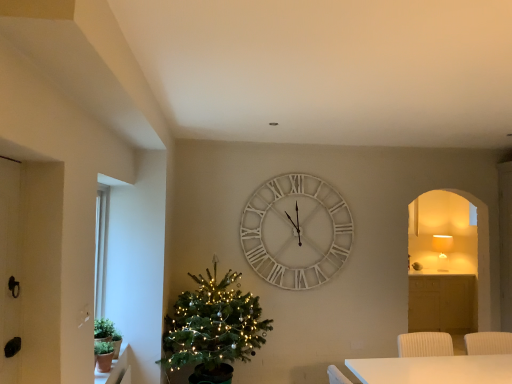
Question: Is point (96, 367) positioned closer to the camera than point (305, 274)?

Choices:
 (A) farther
 (B) closer

Answer: (B)

Question: Is terracotta clay pot at lower left wider or thinner than white wooden clock at center?

Choices:
 (A) wide
 (B) thin

Answer: (A)

Question: Which object is the farthest from the black matte glass door at left?

Choices:
 (A) terracotta clay pot at lower left
 (B) green matte plant at lower left
 (C) white wooden clock at center
 (D) matte white lampshade at right
 (E) green matte christmas tree at left

Answer: (D)

Question: Estimate the real-world distances between objects in this image. Which object is farther from the green matte christmas tree at left?

Choices:
 (A) black matte glass door at left
 (B) white wooden clock at center
 (C) matte white lampshade at right
 (D) green matte plant at lower left
 (E) terracotta clay pot at lower left

Answer: (C)